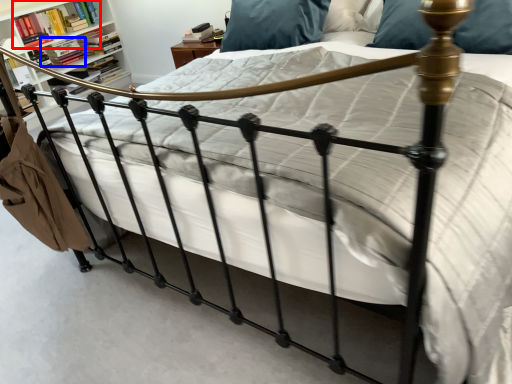
Question: Which object is further to the camera taking this photo, book (highlighted by a red box) or book (highlighted by a blue box)?

Choices:
 (A) book
 (B) book

Answer: (B)